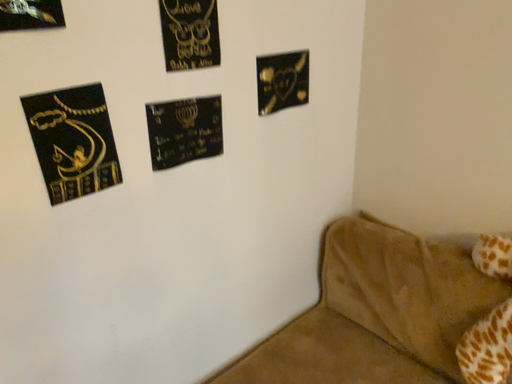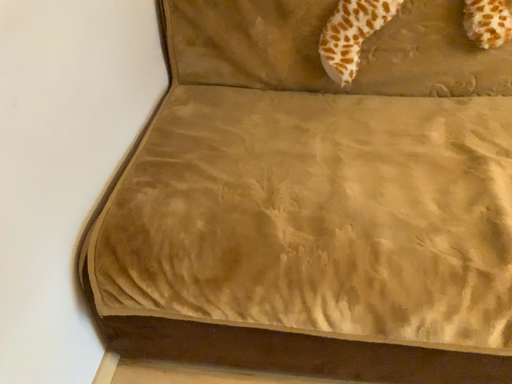
Question: Which way did the camera rotate in the video?

Choices:
 (A) rotated right
 (B) rotated left

Answer: (A)